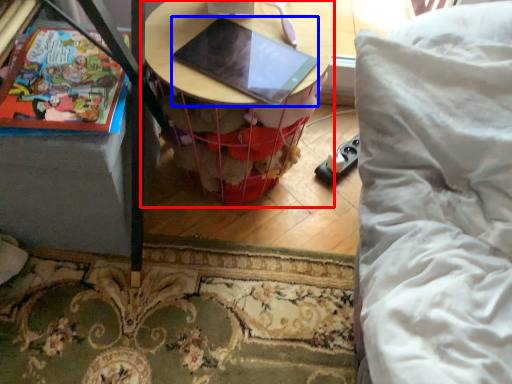
Question: Which point is closer to the camera, table (highlighted by a red box) or laptop (highlighted by a blue box)?

Choices:
 (A) table
 (B) laptop

Answer: (B)